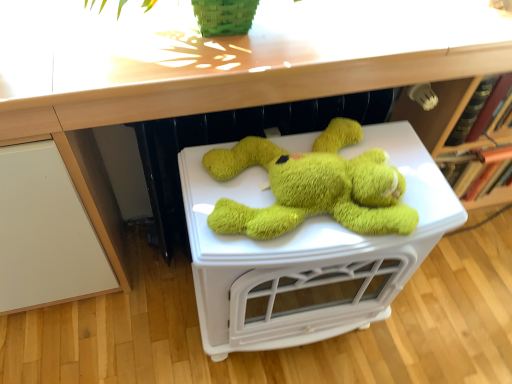
Locate an element on the screen. free space above wooden at upper center (from a real-world perspective) is located at coordinates (259, 27).